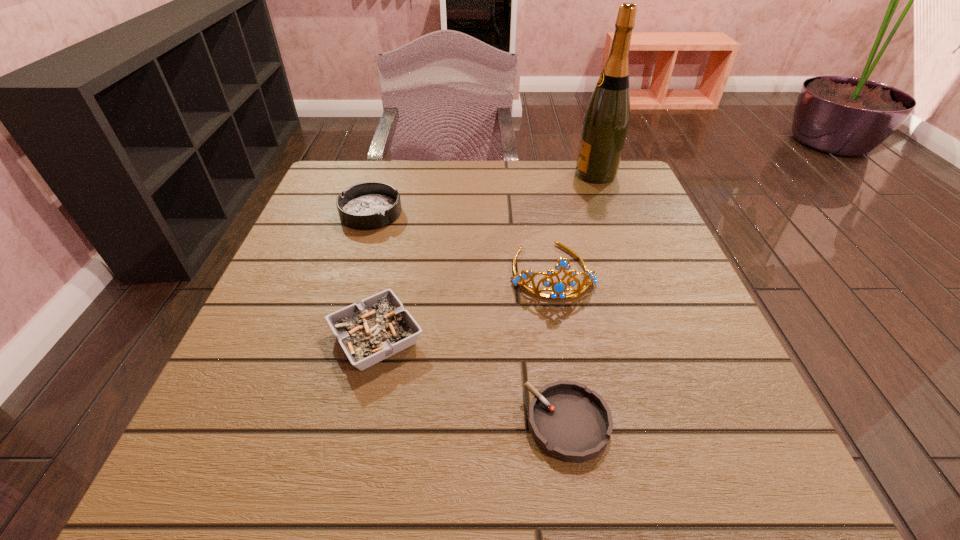
Where is `vacant space at the far edge`? vacant space at the far edge is located at coordinates (427, 184).

Identify the location of vacant space at the near edge of the desktop. (430, 440).

In the image, there is a desktop. In order to click on vacant space at the left edge in this screenshot , I will do `click(279, 327)`.

You are a GUI agent. You are given a task and a screenshot of the screen. Output one action in this format:
    pyautogui.click(x=<x>, y=<y>)
    Task: Click on the free space at the right edge
    This screenshot has width=960, height=540.
    Given the screenshot: What is the action you would take?
    pyautogui.click(x=728, y=387)

Find the location of a particular element. vacant space at the far left corner of the desktop is located at coordinates (361, 180).

The image size is (960, 540). I want to click on blank space at the near left corner of the desktop, so click(x=197, y=451).

Locate an element on the screen. The width and height of the screenshot is (960, 540). vacant area at the far right corner is located at coordinates (639, 212).

What are the coordinates of `free space at the near right corner of the desktop` in the screenshot? It's located at (674, 488).

This screenshot has width=960, height=540. In order to click on free space between the rightmost ashtray and the rightmost object in this screenshot , I will do `click(582, 299)`.

Identify the location of free space between the second tallest object and the second nearest ashtray. The image size is (960, 540). pos(464,305).